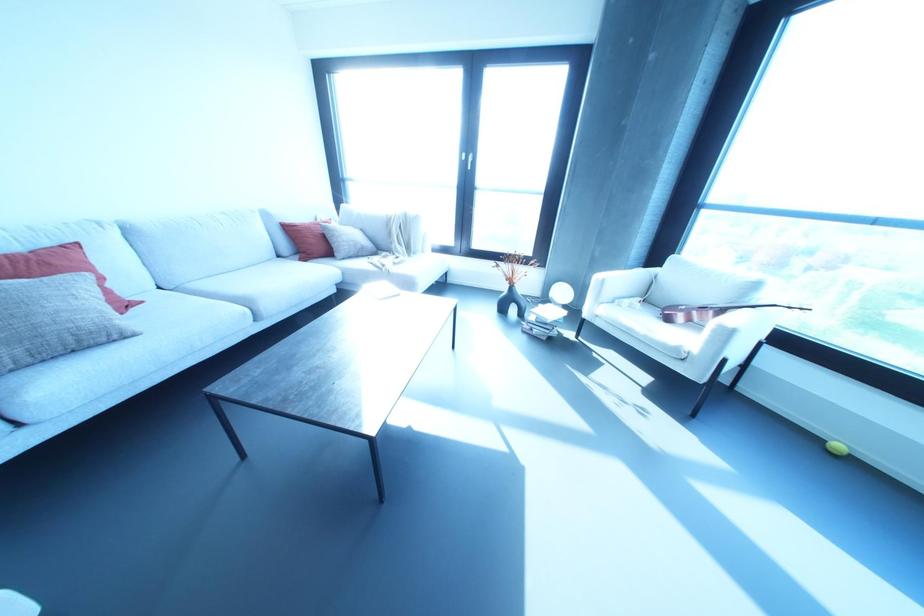
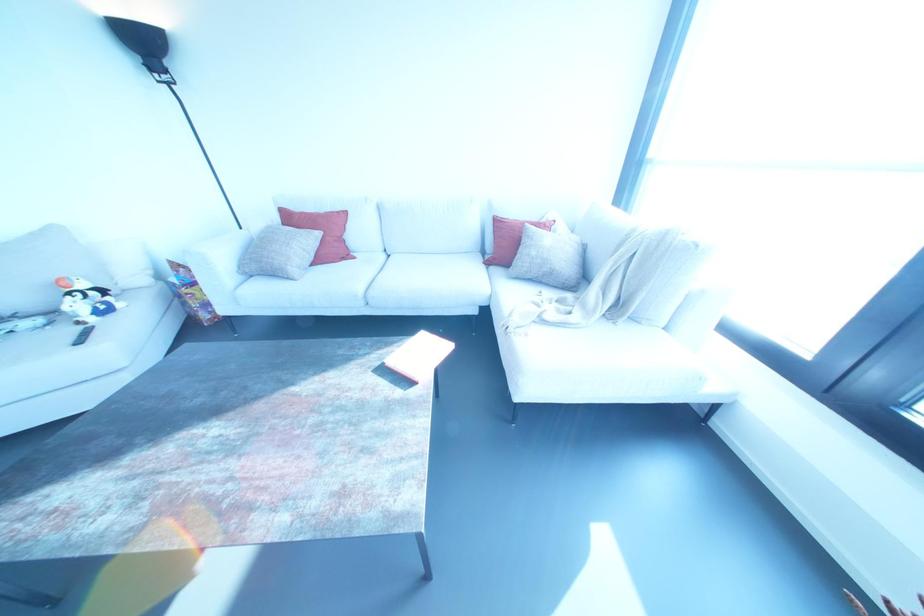
The point at [361,246] is marked in the first image. Where is the corresponding point in the second image?

(551, 273)